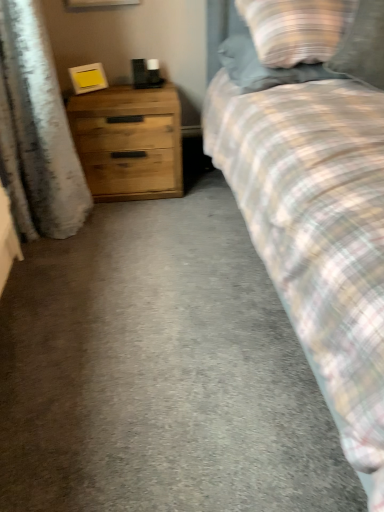
Question: Should I look upward or downward to see plaid fabric pillow at upper right, which is the second pillow in left-to-right order?

Choices:
 (A) down
 (B) up

Answer: (B)

Question: Can you see plaid fabric pillow at upper right, the first pillow from the right, touching plaid fabric pillow at upper right, acting as the second pillow starting from the right?

Choices:
 (A) yes
 (B) no

Answer: (B)

Question: Considering the relative positions of plaid fabric pillow at upper right, the first pillow from the right, and plaid fabric pillow at upper right, marked as the first pillow in a left-to-right arrangement, in the image provided, is plaid fabric pillow at upper right, the first pillow from the right, to the right of plaid fabric pillow at upper right, marked as the first pillow in a left-to-right arrangement, from the viewer's perspective?

Choices:
 (A) no
 (B) yes

Answer: (B)

Question: Is plaid fabric pillow at upper right, which is the second pillow in left-to-right order, wider than plaid fabric pillow at upper right, acting as the second pillow starting from the right?

Choices:
 (A) yes
 (B) no

Answer: (B)

Question: Could plaid fabric pillow at upper right, marked as the first pillow in a left-to-right arrangement, be considered to be inside plaid fabric pillow at upper right, the first pillow from the right?

Choices:
 (A) yes
 (B) no

Answer: (B)

Question: Considering the relative sizes of plaid fabric pillow at upper right, which is the second pillow in left-to-right order, and plaid fabric pillow at upper right, acting as the second pillow starting from the right, in the image provided, is plaid fabric pillow at upper right, which is the second pillow in left-to-right order, smaller than plaid fabric pillow at upper right, acting as the second pillow starting from the right,?

Choices:
 (A) no
 (B) yes

Answer: (B)

Question: Is plaid fabric pillow at upper right, the first pillow from the right, shorter than plaid fabric pillow at upper right, acting as the second pillow starting from the right?

Choices:
 (A) no
 (B) yes

Answer: (A)

Question: From a real-world perspective, is white textured curtain at left physically above wooden chest of drawers at left?

Choices:
 (A) yes
 (B) no

Answer: (A)

Question: Is wooden chest of drawers at left at the back of white textured curtain at left?

Choices:
 (A) yes
 (B) no

Answer: (B)

Question: Is white textured curtain at left at the right side of wooden chest of drawers at left?

Choices:
 (A) yes
 (B) no

Answer: (B)

Question: Is white textured curtain at left wider than wooden chest of drawers at left?

Choices:
 (A) yes
 (B) no

Answer: (B)

Question: Considering the relative sizes of white textured curtain at left and wooden chest of drawers at left in the image provided, is white textured curtain at left taller than wooden chest of drawers at left?

Choices:
 (A) no
 (B) yes

Answer: (B)

Question: From the image's perspective, is white textured curtain at left located beneath wooden chest of drawers at left?

Choices:
 (A) yes
 (B) no

Answer: (A)

Question: Can we say wooden chest of drawers at left lies outside plaid fabric pillow at upper right, the first pillow from the right?

Choices:
 (A) yes
 (B) no

Answer: (A)